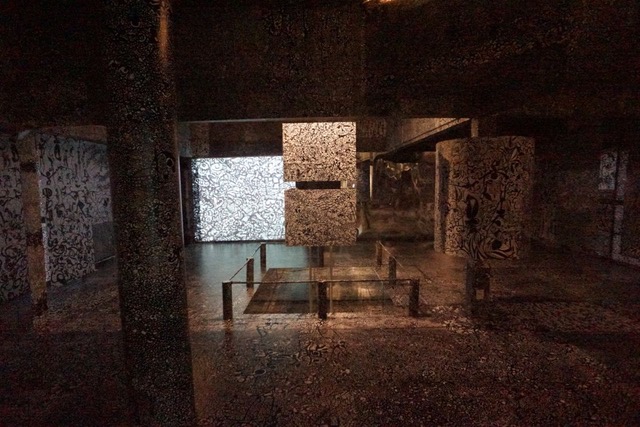
Locate an element on the screen. electric outlet is located at coordinates (481, 297).